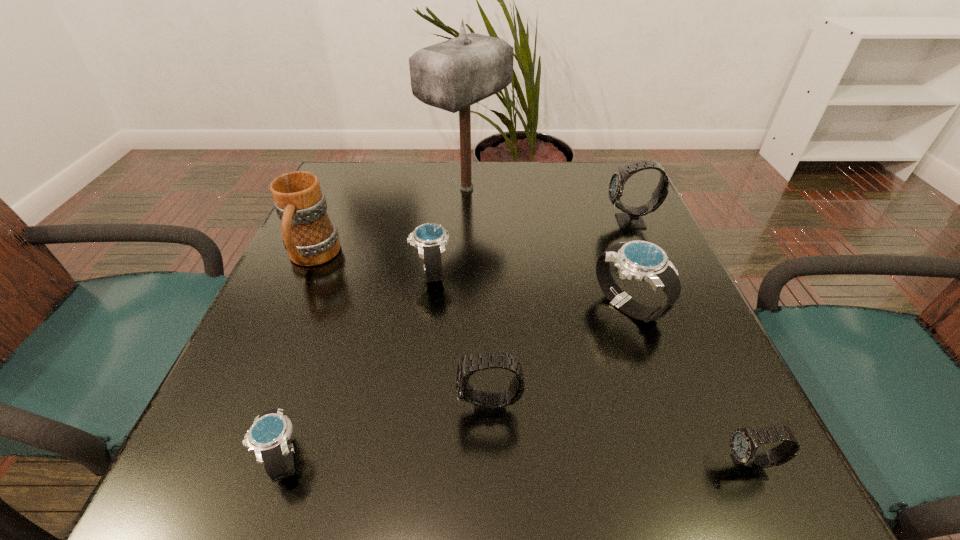
Locate an element on the screen. The width and height of the screenshot is (960, 540). the tallest object is located at coordinates (452, 75).

Where is `mug`? This screenshot has width=960, height=540. mug is located at coordinates (311, 239).

The image size is (960, 540). In order to click on the farthest gray watch in this screenshot , I will do `click(632, 218)`.

Identify the location of the biggest gray watch. The width and height of the screenshot is (960, 540). (632, 218).

This screenshot has width=960, height=540. Find the location of `the rightmost silver watch`. the rightmost silver watch is located at coordinates (641, 260).

Where is `the third nearest watch`? This screenshot has height=540, width=960. the third nearest watch is located at coordinates (489, 407).

The image size is (960, 540). I want to click on the second smallest gray watch, so click(x=489, y=407).

Identify the location of the second biggest silver watch. This screenshot has width=960, height=540. (430, 238).

At what (x,y) coordinates should I click in order to perform the action: click on the second watch from left to right. Please return your answer as a coordinate pair (x, y). Looking at the image, I should click on (430, 238).

Where is `the nearest gray watch`? This screenshot has width=960, height=540. the nearest gray watch is located at coordinates (744, 442).